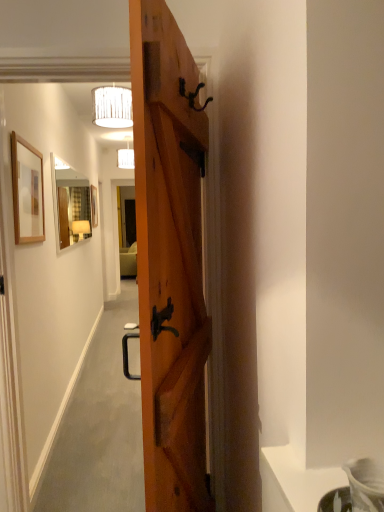
Question: Is white fabric lampshade at upper center, the second lamp when ordered from left to right, shorter than matte white lampshade at upper center, the first lamp viewed from the left?

Choices:
 (A) yes
 (B) no

Answer: (A)

Question: From the image's perspective, is white fabric lampshade at upper center, which is counted as the 1th lamp, starting from the front, over matte white lampshade at upper center, the 1th lamp viewed from the back?

Choices:
 (A) no
 (B) yes

Answer: (A)

Question: Is white fabric lampshade at upper center, which ranks as the 2th lamp in back-to-front order, closer to the viewer compared to matte white lampshade at upper center, the first lamp viewed from the left?

Choices:
 (A) no
 (B) yes

Answer: (B)

Question: Does white fabric lampshade at upper center, the second lamp when ordered from left to right, have a lesser width compared to matte white lampshade at upper center, the first lamp viewed from the left?

Choices:
 (A) yes
 (B) no

Answer: (A)

Question: Is white fabric lampshade at upper center, the second lamp when ordered from left to right, not inside matte white lampshade at upper center, placed as the 2th lamp when sorted from right to left?

Choices:
 (A) yes
 (B) no

Answer: (A)

Question: Considering the relative sizes of white fabric lampshade at upper center, the second lamp when ordered from left to right, and matte white lampshade at upper center, acting as the second lamp starting from the front, in the image provided, is white fabric lampshade at upper center, the second lamp when ordered from left to right, smaller than matte white lampshade at upper center, acting as the second lamp starting from the front,?

Choices:
 (A) no
 (B) yes

Answer: (A)

Question: Is wooden picture frame at center, placed as the first picture frame when sorted from back to front, in front of wooden door at center?

Choices:
 (A) yes
 (B) no

Answer: (B)

Question: Is wooden picture frame at center, positioned as the 1th picture frame in left-to-right order, to the right of wooden door at center from the viewer's perspective?

Choices:
 (A) no
 (B) yes

Answer: (A)

Question: From a real-world perspective, is wooden picture frame at center, acting as the 2th picture frame starting from the right, located beneath wooden door at center?

Choices:
 (A) no
 (B) yes

Answer: (A)

Question: Does wooden picture frame at center, arranged as the second picture frame when viewed from the front, touch wooden door at center?

Choices:
 (A) no
 (B) yes

Answer: (A)

Question: Is there a large distance between wooden picture frame at center, acting as the 2th picture frame starting from the right, and wooden door at center?

Choices:
 (A) yes
 (B) no

Answer: (A)

Question: From the image's perspective, does wooden picture frame at center, positioned as the 1th picture frame in left-to-right order, appear higher than wooden door at center?

Choices:
 (A) no
 (B) yes

Answer: (B)

Question: Is wooden picture frame at upper left, which is the 1th picture frame from right to left, in front of matte wooden mirror at upper center?

Choices:
 (A) yes
 (B) no

Answer: (A)